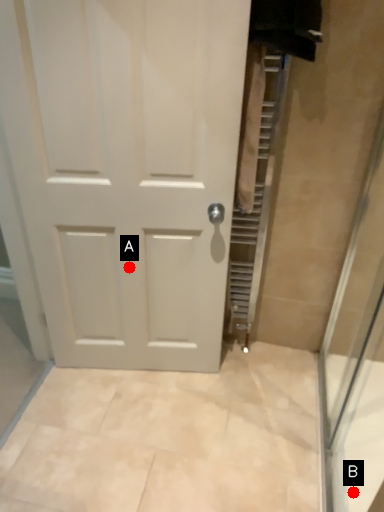
Question: Two points are circled on the image, labeled by A and B beside each circle. Which point appears closest to the camera in this image?

Choices:
 (A) A is closer
 (B) B is closer

Answer: (B)